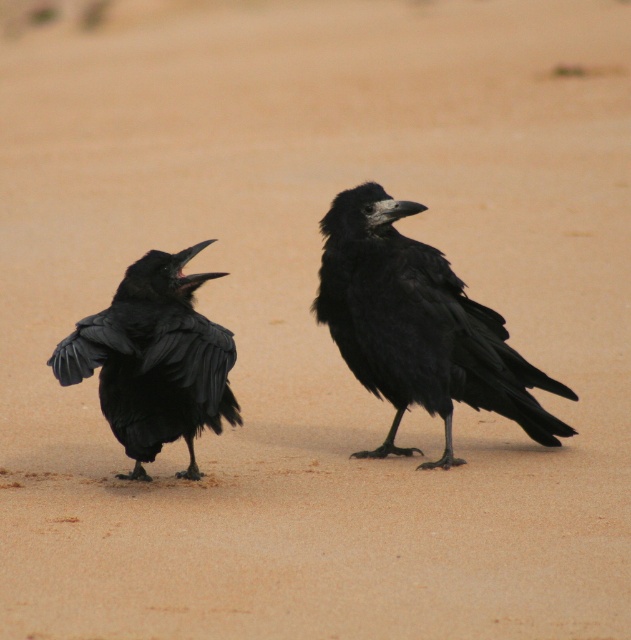
Question: Is shiny black raven at center positioned at the back of shiny black raven at left?

Choices:
 (A) no
 (B) yes

Answer: (B)

Question: Which object appears farthest from the camera in this image?

Choices:
 (A) shiny black raven at center
 (B) shiny black raven at left

Answer: (A)

Question: Is shiny black raven at center thinner than shiny black raven at left?

Choices:
 (A) yes
 (B) no

Answer: (B)

Question: Is shiny black raven at center bigger than shiny black raven at left?

Choices:
 (A) yes
 (B) no

Answer: (A)

Question: Among these objects, which one is farthest from the camera?

Choices:
 (A) shiny black raven at left
 (B) shiny black raven at center

Answer: (B)

Question: Which point is closer to the camera?

Choices:
 (A) shiny black raven at center
 (B) shiny black raven at left

Answer: (B)